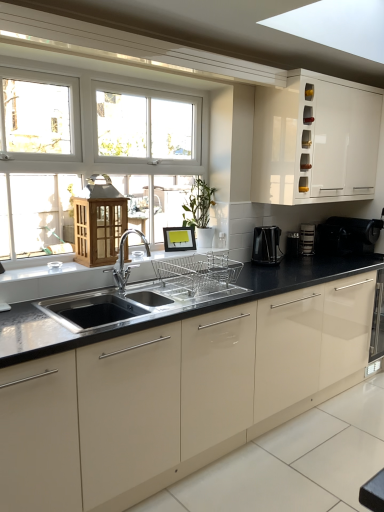
Question: From a real-world perspective, is black plastic coffee maker at right, which appears as the second appliance when viewed from the left, beneath black glossy countertop at center?

Choices:
 (A) yes
 (B) no

Answer: (B)

Question: Considering the relative sizes of black plastic coffee maker at right, which appears as the second appliance when viewed from the left, and black glossy countertop at center in the image provided, is black plastic coffee maker at right, which appears as the second appliance when viewed from the left, smaller than black glossy countertop at center?

Choices:
 (A) no
 (B) yes

Answer: (B)

Question: Does black plastic coffee maker at right, which appears as the second appliance when viewed from the left, have a lesser height compared to black glossy countertop at center?

Choices:
 (A) no
 (B) yes

Answer: (B)

Question: From the image's perspective, is black plastic coffee maker at right, which appears as the second appliance when viewed from the left, located above black glossy countertop at center?

Choices:
 (A) yes
 (B) no

Answer: (A)

Question: Does black plastic coffee maker at right, which is the 1th appliance from right to left, appear on the right side of black glossy countertop at center?

Choices:
 (A) yes
 (B) no

Answer: (A)

Question: From a real-world perspective, is white glossy cabinet at upper right above or below black plastic coffee maker at center right, marked as the second appliance in a right-to-left arrangement?

Choices:
 (A) below
 (B) above

Answer: (B)

Question: Do you think white glossy cabinet at upper right is within black plastic coffee maker at center right, the first appliance in the left-to-right sequence, or outside of it?

Choices:
 (A) outside
 (B) inside

Answer: (A)

Question: Considering the positions of white glossy cabinet at upper right and black plastic coffee maker at center right, the first appliance in the left-to-right sequence, in the image, is white glossy cabinet at upper right taller or shorter than black plastic coffee maker at center right, the first appliance in the left-to-right sequence,?

Choices:
 (A) short
 (B) tall

Answer: (B)

Question: Considering the positions of white glossy cabinet at upper right and black plastic coffee maker at center right, marked as the second appliance in a right-to-left arrangement, in the image, is white glossy cabinet at upper right wider or thinner than black plastic coffee maker at center right, marked as the second appliance in a right-to-left arrangement,?

Choices:
 (A) wide
 (B) thin

Answer: (A)

Question: From the image's perspective, is black plastic coffee maker at center right, the first appliance in the left-to-right sequence, above or below white glossy cabinet at upper right?

Choices:
 (A) above
 (B) below

Answer: (B)

Question: Is black plastic coffee maker at center right, the first appliance in the left-to-right sequence, to the left or to the right of white glossy cabinet at upper right in the image?

Choices:
 (A) right
 (B) left

Answer: (B)

Question: Is black plastic coffee maker at center right, the first appliance in the left-to-right sequence, in front of or behind white glossy cabinet at upper right in the image?

Choices:
 (A) front
 (B) behind

Answer: (B)

Question: Is black plastic coffee maker at center right, marked as the second appliance in a right-to-left arrangement, inside the boundaries of white glossy cabinet at upper right, or outside?

Choices:
 (A) outside
 (B) inside

Answer: (A)

Question: Would you say black plastic coffee machine at right, marked as the first coffee machine in a left-to-right arrangement, is to the left or to the right of black glossy countertop at center in the picture?

Choices:
 (A) right
 (B) left

Answer: (A)

Question: From a real-world perspective, is black plastic coffee machine at right, which is the 2th coffee machine in right-to-left order, positioned above or below black glossy countertop at center?

Choices:
 (A) above
 (B) below

Answer: (A)